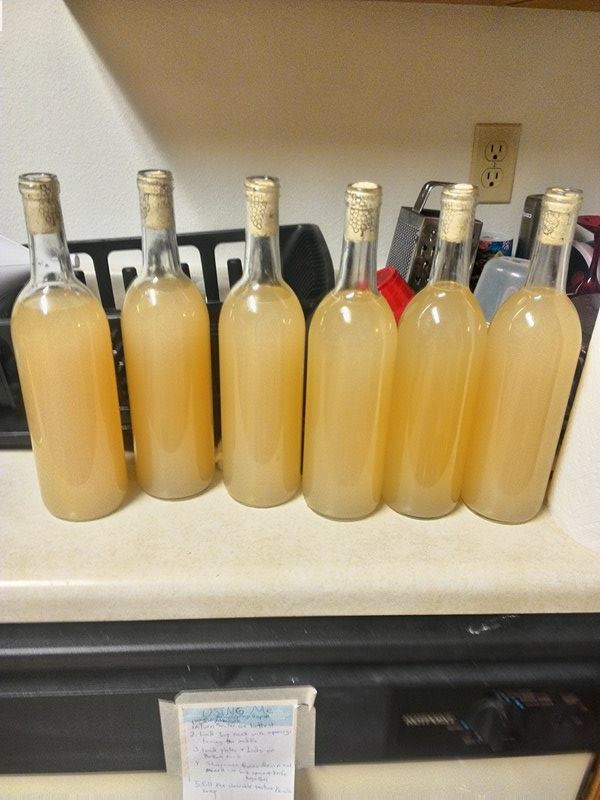
Locate an element on the screen. handle of metal cheese grater is located at coordinates (424, 184).